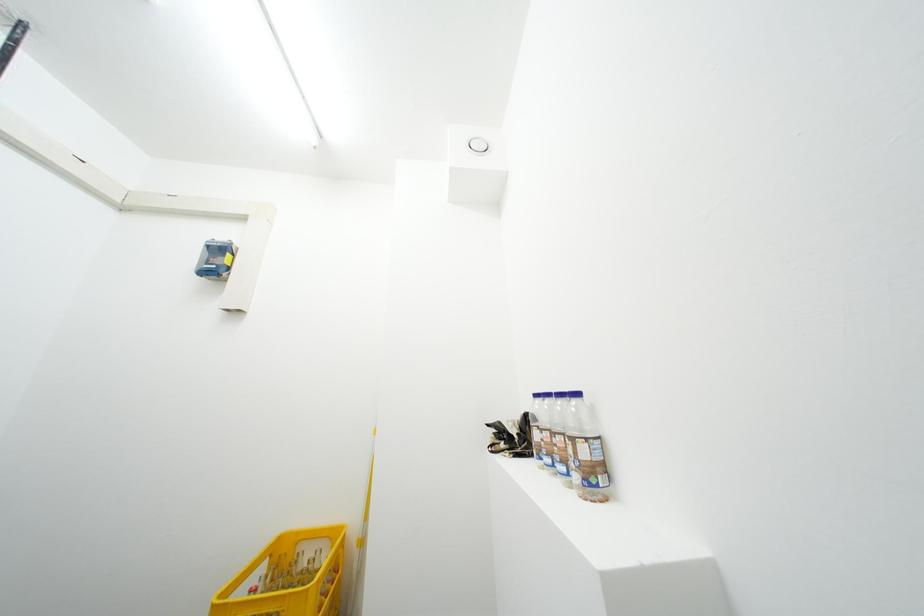
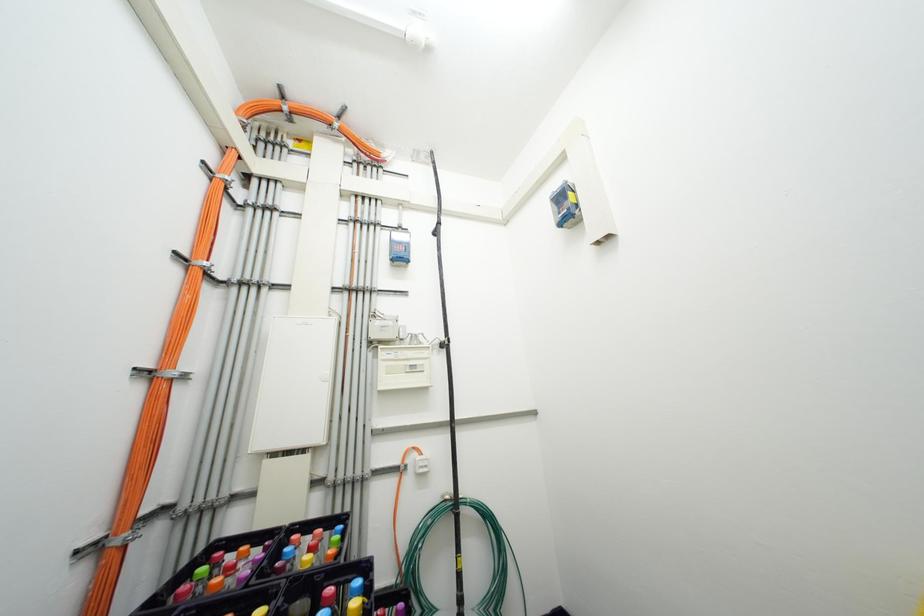
Question: The camera is either moving clockwise (left) or counter-clockwise (right) around the object. The first image is from the beginning of the video and the second image is from the end. Is the camera moving left or right when shooting the video?

Choices:
 (A) Left
 (B) Right

Answer: (B)